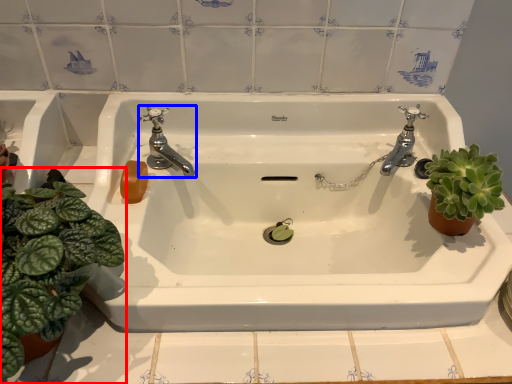
Question: Which point is closer to the camera, houseplant (highlighted by a red box) or tap (highlighted by a blue box)?

Choices:
 (A) houseplant
 (B) tap

Answer: (A)